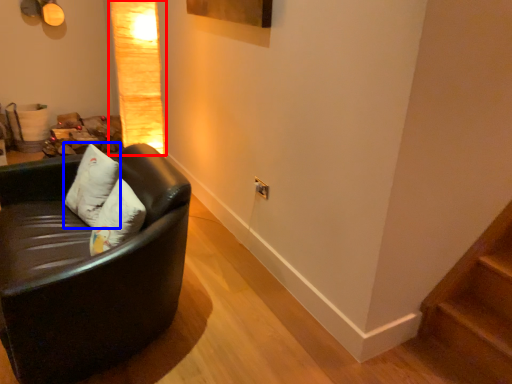
Question: Among these objects, which one is nearest to the camera, lamp (highlighted by a red box) or pillow (highlighted by a blue box)?

Choices:
 (A) lamp
 (B) pillow

Answer: (B)